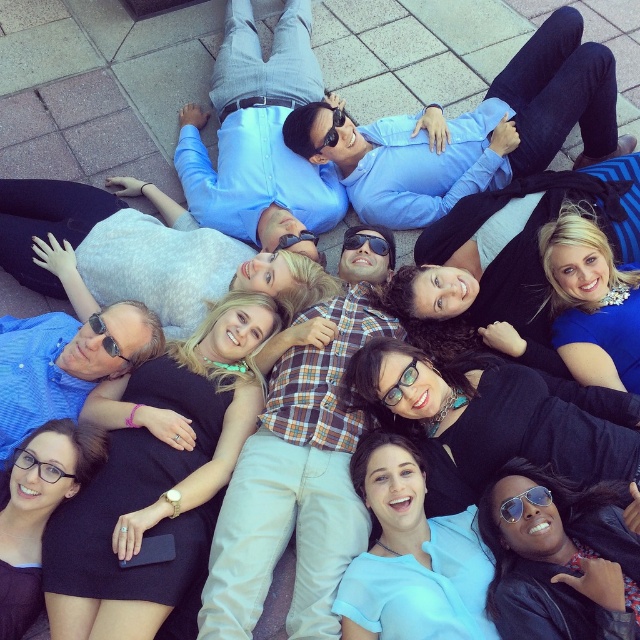
Between point (490, 627) and point (88, 355), which one is positioned behind?

The point (88, 355) is behind.

Is light blue fabric at center further to the viewer compared to matte blue shirt at upper left?

No.

Where is `light blue fabric at center`? This screenshot has width=640, height=640. light blue fabric at center is located at coordinates (412, 556).

You are a GUI agent. You are given a task and a screenshot of the screen. Output one action in this format:
    pyautogui.click(x=<x>, y=<y>)
    Task: Click on the light blue fabric at center
    The height and width of the screenshot is (640, 640).
    Given the screenshot: What is the action you would take?
    pyautogui.click(x=412, y=556)

Between matte gray sweater at center and black plastic sunglasses at upper center, which one has less height?

Standing shorter between the two is black plastic sunglasses at upper center.

Which is in front, point (1, 220) or point (104, 332)?

Point (104, 332)

Locate an element on the screen. matte gray sweater at center is located at coordinates (144, 252).

Who is shorter, light blue fabric at center or aviator sunglasses at lower right?

With less height is aviator sunglasses at lower right.

Who is positioned more to the left, light blue fabric at center or aviator sunglasses at lower right?

From the viewer's perspective, light blue fabric at center appears more on the left side.

Between point (396, 620) and point (509, 518), which one is positioned in front?

Point (396, 620) is in front.

Where is `light blue fabric at center`? Image resolution: width=640 pixels, height=640 pixels. light blue fabric at center is located at coordinates (412, 556).